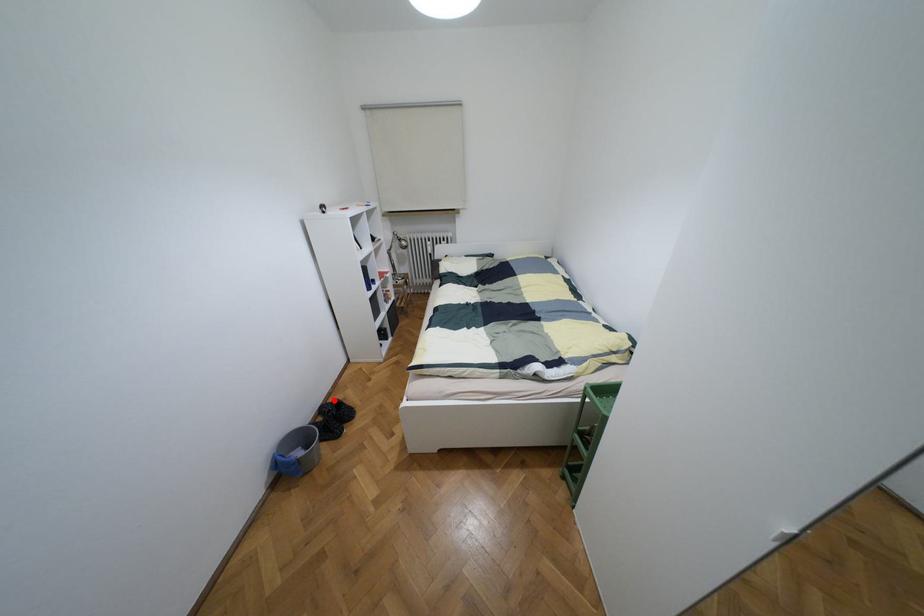
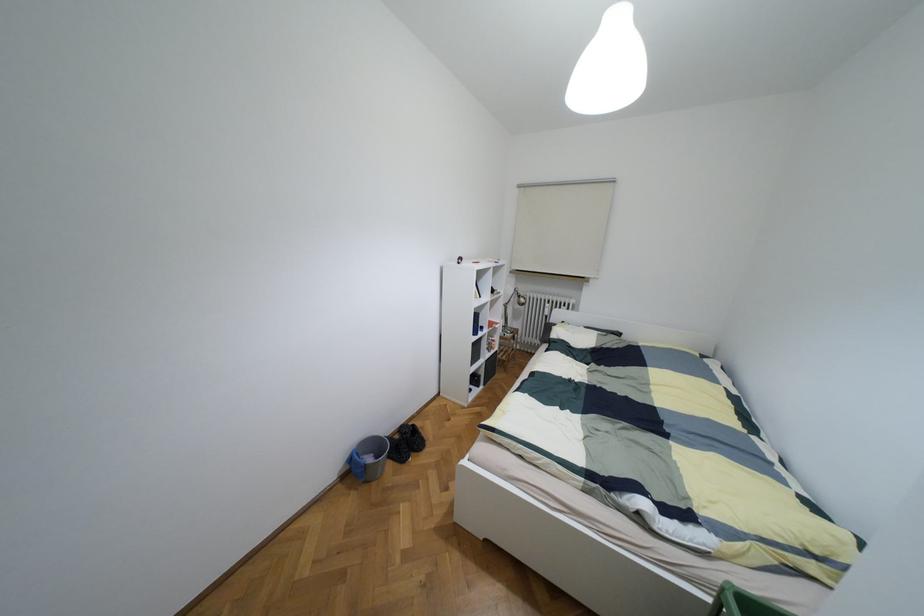
Locate, in the second image, the point that corresponds to the highlighted location in the first image.

(412, 424)